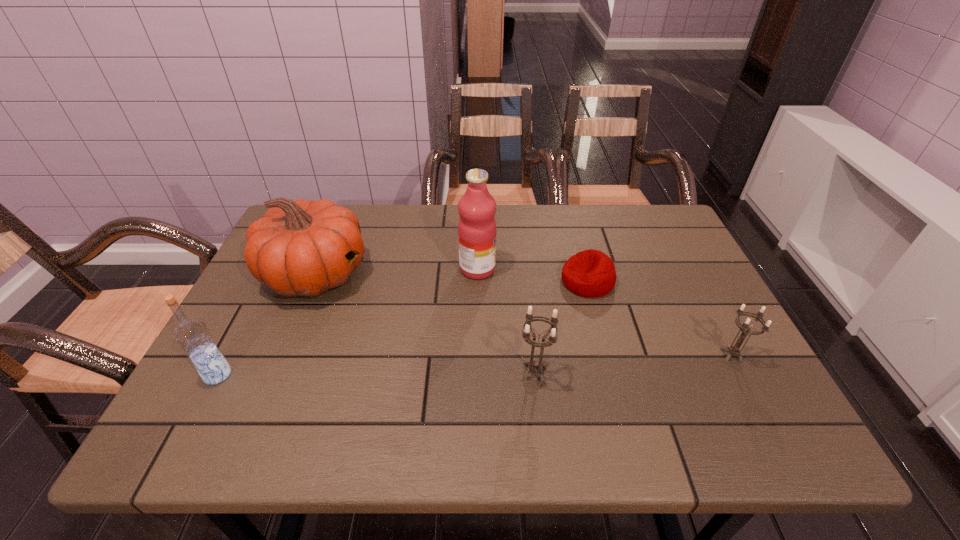
Where is `vodka positioned at the near edge`? Image resolution: width=960 pixels, height=540 pixels. vodka positioned at the near edge is located at coordinates (192, 335).

What are the coordinates of `pumpkin situated at the left edge` in the screenshot? It's located at (298, 248).

The width and height of the screenshot is (960, 540). Identify the location of vodka situated at the left edge. (192, 335).

Identify the location of object that is positioned at the right edge. (734, 350).

Find the location of `object that is at the far left corner`. object that is at the far left corner is located at coordinates (298, 248).

Image resolution: width=960 pixels, height=540 pixels. I want to click on object situated at the near left corner, so click(x=192, y=335).

Identify the location of vacant space at the far edge of the desktop. [x=454, y=206].

Locate an element on the screen. The width and height of the screenshot is (960, 540). free space at the near edge is located at coordinates (611, 376).

You are a GUI agent. You are given a task and a screenshot of the screen. Output one action in this format:
    pyautogui.click(x=<x>, y=<y>)
    Task: Click on the free space at the left edge of the desktop
    
    Given the screenshot: What is the action you would take?
    pyautogui.click(x=281, y=298)

Identify the location of vacant space at the right edge. This screenshot has height=540, width=960. (678, 338).